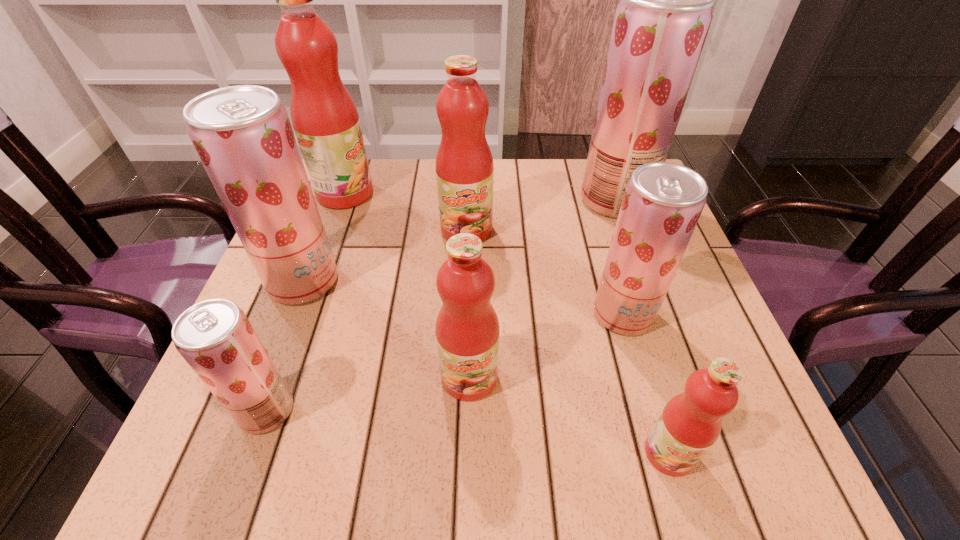
Image resolution: width=960 pixels, height=540 pixels. In order to click on vacant space located 0.190m on the front label of the farthest pink fruit juice in this screenshot , I will do `click(448, 193)`.

Find the location of `vacant position located on the left of the biggest strawberry fruit juice`. vacant position located on the left of the biggest strawberry fruit juice is located at coordinates click(484, 200).

You are a GUI agent. You are given a task and a screenshot of the screen. Output one action in this format:
    pyautogui.click(x=<x>, y=<y>)
    Task: Click on the vacant space located on the back of the second biggest strawberry fruit juice
    The height and width of the screenshot is (540, 960).
    Given the screenshot: What is the action you would take?
    pyautogui.click(x=324, y=227)

Where is `free space located on the front label of the second biggest pink fruit juice`? free space located on the front label of the second biggest pink fruit juice is located at coordinates (466, 266).

The height and width of the screenshot is (540, 960). I want to click on free space located on the back of the second smallest strawberry fruit juice, so click(601, 239).

The width and height of the screenshot is (960, 540). I want to click on blank area located on the front label of the third biggest pink fruit juice, so click(468, 452).

You are a GUI agent. You are given a task and a screenshot of the screen. Output one action in this format:
    pyautogui.click(x=<x>, y=<y>)
    Task: Click on the vacant space located 0.270m on the right of the nearest strawberry fruit juice
    Image resolution: width=960 pixels, height=540 pixels.
    Given the screenshot: What is the action you would take?
    pyautogui.click(x=463, y=410)

I want to click on object that is positioned at the far left corner, so click(x=325, y=119).

Identify the location of object that is positioned at the near left corner. The image size is (960, 540). (216, 339).

Identify the location of object that is at the far right corner. Image resolution: width=960 pixels, height=540 pixels. tap(661, 23).